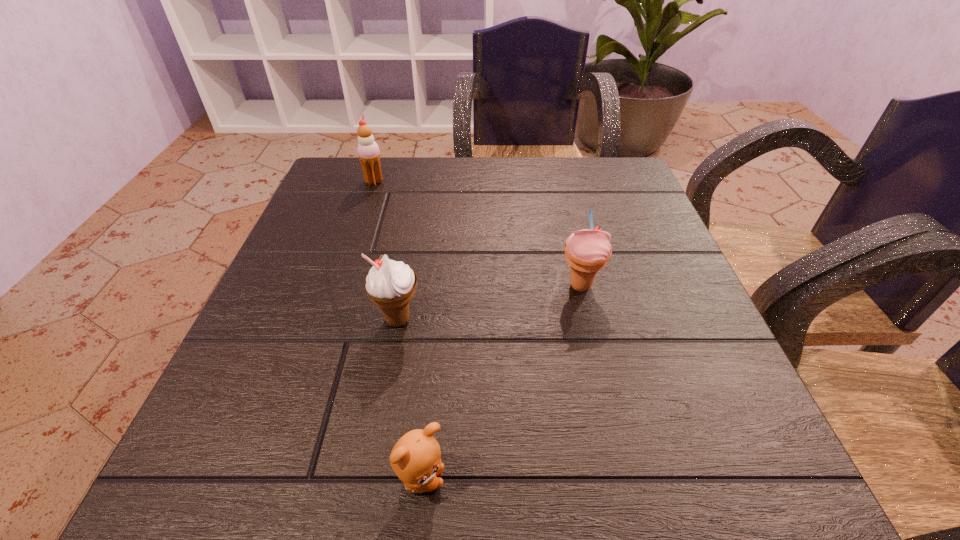
Find the location of a particular element. Image resolution: width=960 pixels, height=540 pixels. vacant space located 0.330m on the back of the rightmost object is located at coordinates (556, 181).

The height and width of the screenshot is (540, 960). I want to click on vacant space located on the face of the nearest object, so pyautogui.click(x=563, y=480).

This screenshot has width=960, height=540. Find the location of `object that is positioned at the far edge`. object that is positioned at the far edge is located at coordinates (368, 151).

Where is `object present at the near edge`? object present at the near edge is located at coordinates (416, 458).

Where is `object at the left edge`? object at the left edge is located at coordinates (368, 151).

Where is `object positioned at the right edge`? This screenshot has height=540, width=960. object positioned at the right edge is located at coordinates (587, 251).

Where is `object situated at the far left corner`? object situated at the far left corner is located at coordinates (368, 151).

In the image, there is a desktop. In order to click on vacant space at the far edge in this screenshot , I will do `click(554, 169)`.

In the image, there is a desktop. Where is `vacant space at the near edge`? The height and width of the screenshot is (540, 960). vacant space at the near edge is located at coordinates (405, 500).

Where is `vacant space at the left edge`? vacant space at the left edge is located at coordinates (329, 221).